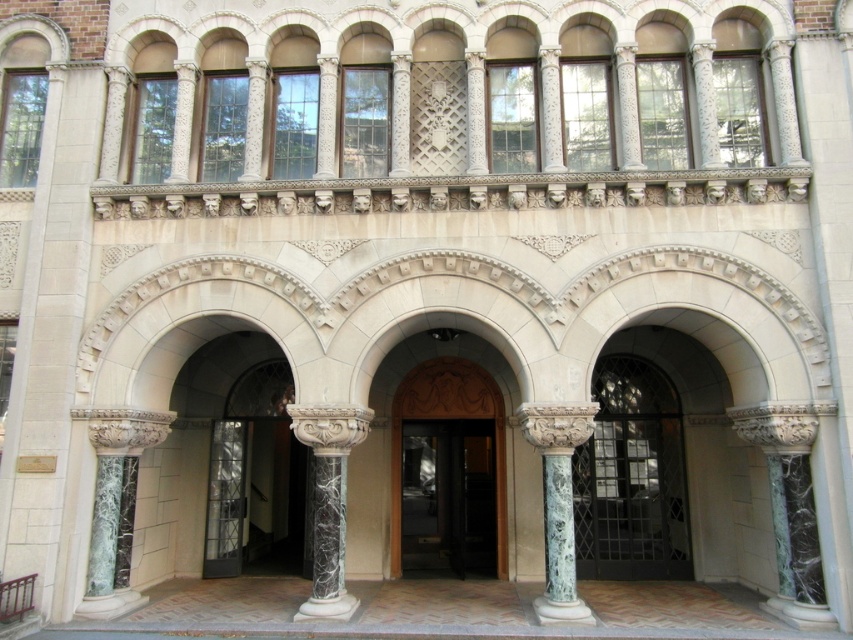
Describe the element at coordinates (448, 497) in the screenshot. I see `black glass door at center` at that location.

Is black glass door at center above green marble column at center?

Actually, black glass door at center is below green marble column at center.

Locate an element on the screen. The width and height of the screenshot is (853, 640). black glass door at center is located at coordinates (448, 497).

Locate an element on the screen. Image resolution: width=853 pixels, height=640 pixels. black glass door at center is located at coordinates (448, 497).

Can you confirm if dark green marble door at center is taller than marble column at center?

Correct, dark green marble door at center is much taller as marble column at center.

Which is behind, point (599, 374) or point (300, 428)?

Positioned behind is point (599, 374).

The height and width of the screenshot is (640, 853). I want to click on dark green marble door at center, so click(631, 477).

This screenshot has width=853, height=640. What are the coordinates of `dark green marble door at center` in the screenshot? It's located at (631, 477).

Between dark green marble door at center and black glass door at center, which one is positioned lower?

black glass door at center is below.

Locate an element on the screen. The width and height of the screenshot is (853, 640). dark green marble door at center is located at coordinates (631, 477).